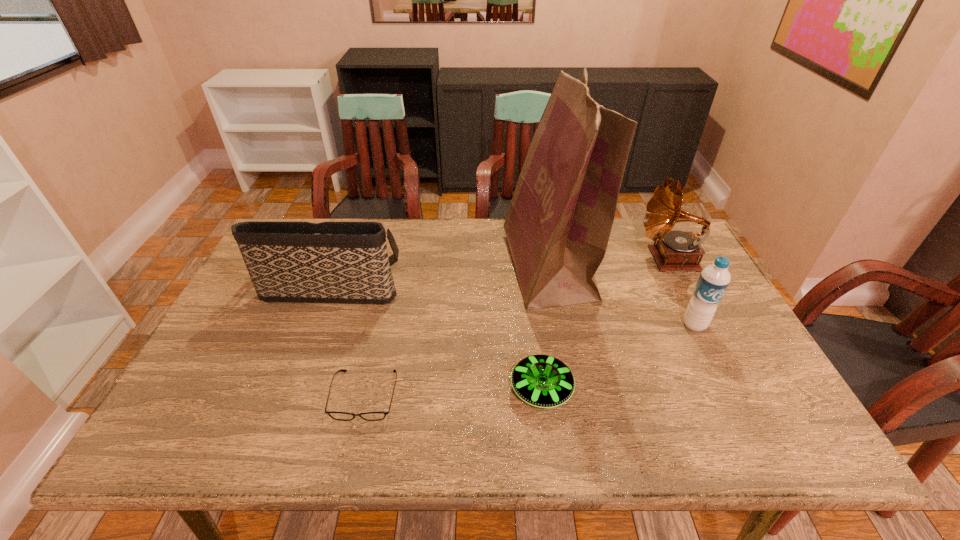
What are the coordinates of `phonograph_record located in the right edge section of the desktop` in the screenshot? It's located at (675, 250).

The image size is (960, 540). In order to click on water bottle at the right edge in this screenshot , I will do `click(714, 279)`.

The image size is (960, 540). Find the location of `object present at the far right corner`. object present at the far right corner is located at coordinates (675, 250).

The image size is (960, 540). What are the coordinates of `vacant space at the far edge of the desktop` in the screenshot? It's located at (619, 237).

Locate an element on the screen. Image resolution: width=960 pixels, height=540 pixels. vacant space at the near edge is located at coordinates pos(322,427).

Identify the location of vacant space at the left edge of the desktop. This screenshot has height=540, width=960. coord(268,313).

Locate an element on the screen. The height and width of the screenshot is (540, 960). free spot at the right edge of the desktop is located at coordinates (709, 355).

In the image, there is a desktop. At what (x,y) coordinates should I click in order to perform the action: click on vacant area at the near left corner. Please return your answer as a coordinate pair (x, y). The image size is (960, 540). Looking at the image, I should click on (179, 425).

Locate an element on the screen. The width and height of the screenshot is (960, 540). unoccupied position between the spectacles and the tallest object is located at coordinates [457, 331].

This screenshot has height=540, width=960. In order to click on free space that is in between the phonograph_record and the saucer in this screenshot , I will do `click(606, 324)`.